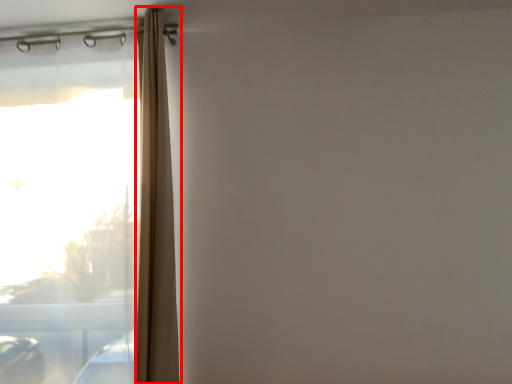
Question: From the image's perspective, considering the relative positions of shower curtain (annotated by the red box) and window in the image provided, where is shower curtain (annotated by the red box) located with respect to the staircase?

Choices:
 (A) below
 (B) above

Answer: (B)